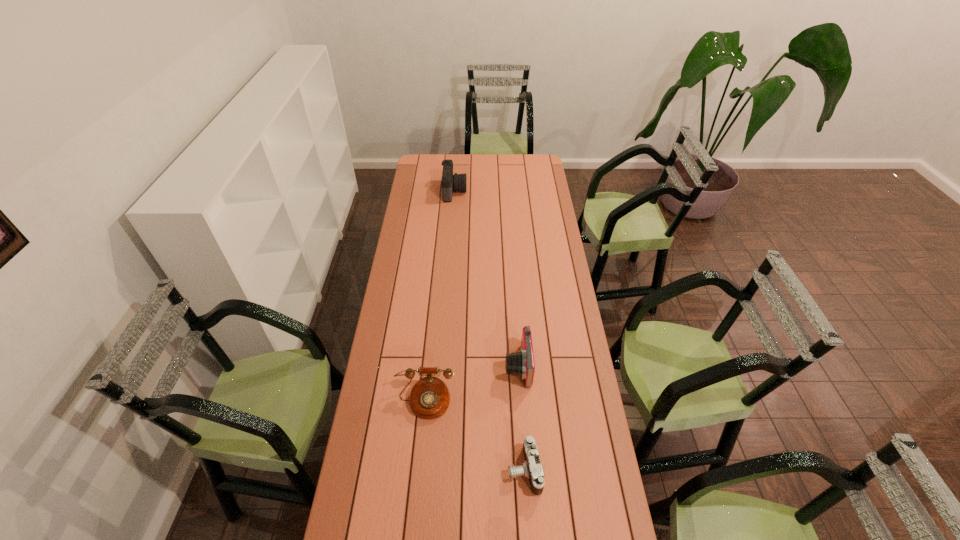
Where is `unoccupied area between the second farthest camera and the nearest camera`? The image size is (960, 540). unoccupied area between the second farthest camera and the nearest camera is located at coordinates (520, 418).

Find the location of `vacant area that lies between the shortest camera and the telephone`. vacant area that lies between the shortest camera and the telephone is located at coordinates (474, 435).

The width and height of the screenshot is (960, 540). In order to click on free space between the leftmost camera and the nearest camera in this screenshot , I will do `click(490, 330)`.

The height and width of the screenshot is (540, 960). I want to click on free spot between the second tallest camera and the telephone, so click(x=471, y=383).

Where is `free space that is in between the leftmost camera and the second farthest camera`? Image resolution: width=960 pixels, height=540 pixels. free space that is in between the leftmost camera and the second farthest camera is located at coordinates (486, 279).

I want to click on free point between the second tallest camera and the leftmost camera, so click(486, 279).

I want to click on free spot between the shortest object and the farthest camera, so click(490, 330).

Identify the location of object that is the third closest one to the leftmost camera. Image resolution: width=960 pixels, height=540 pixels. (531, 468).

Locate an element on the screen. This screenshot has height=540, width=960. object that ranks as the closest to the second farthest camera is located at coordinates (429, 398).

Where is `camera that can be found as the second closest to the telephone`? camera that can be found as the second closest to the telephone is located at coordinates (531, 468).